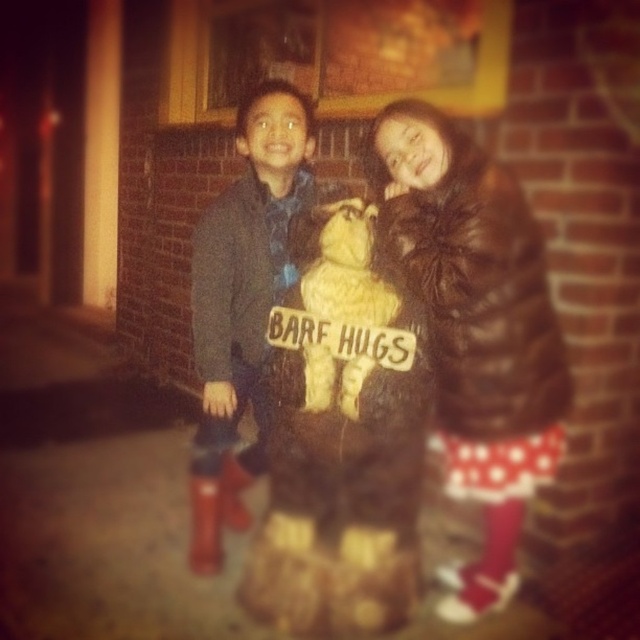
Is matte blue jacket at center to the left of fuzzy beige stuffed bear at center from the viewer's perspective?

Indeed, matte blue jacket at center is positioned on the left side of fuzzy beige stuffed bear at center.

Does point (234, 397) come farther from viewer compared to point (349, 237)?

Yes, point (234, 397) is farther from viewer.

Which is behind, point (275, 80) or point (365, 316)?

Point (275, 80)

Identify the location of matte blue jacket at center. (243, 304).

Consider the image. Does fuzzy brown teddy bear at center have a greater height compared to fuzzy beige stuffed bear at center?

Correct, fuzzy brown teddy bear at center is much taller as fuzzy beige stuffed bear at center.

Which of these two, fuzzy brown teddy bear at center or fuzzy beige stuffed bear at center, stands taller?

Standing taller between the two is fuzzy brown teddy bear at center.

In order to click on fuzzy brown teddy bear at center in this screenshot , I will do `click(368, 360)`.

Between fuzzy brown teddy bear at center and matte blue jacket at center, which one has more height?

Standing taller between the two is fuzzy brown teddy bear at center.

Who is shorter, fuzzy brown teddy bear at center or matte blue jacket at center?

With less height is matte blue jacket at center.

Is point (348, 392) positioned in front of point (230, 396)?

Yes.

This screenshot has height=640, width=640. In order to click on fuzzy brown teddy bear at center in this screenshot , I will do `click(368, 360)`.